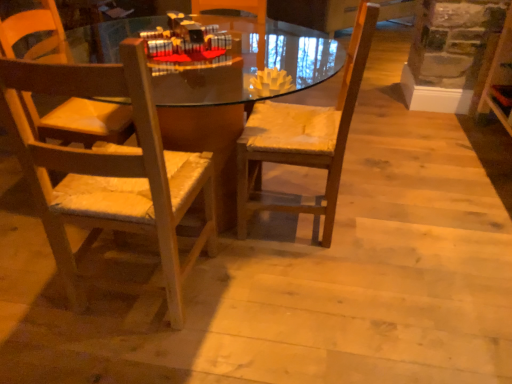
Where is `free location to the right of wooden chair at center, which is the 2th chair from left to right`? free location to the right of wooden chair at center, which is the 2th chair from left to right is located at coordinates tap(382, 211).